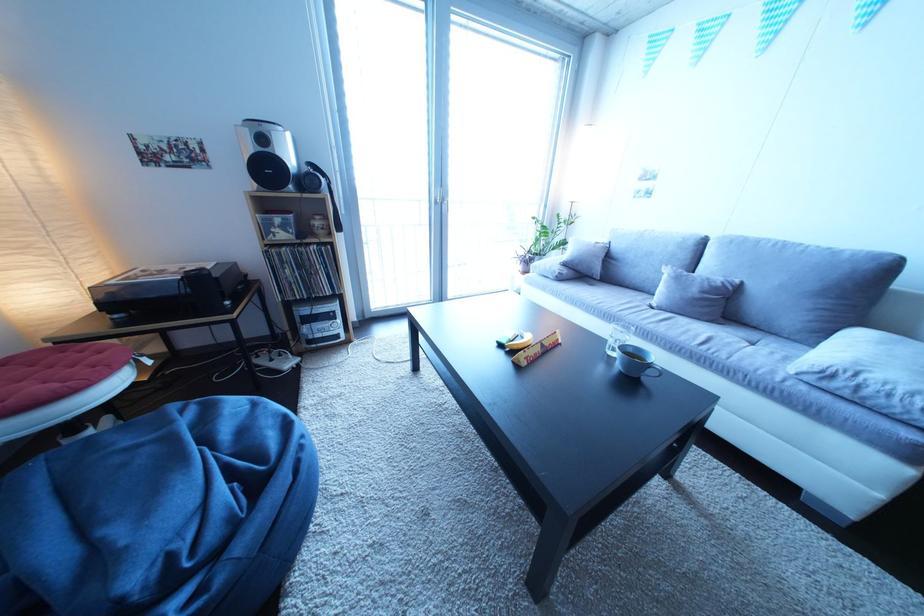
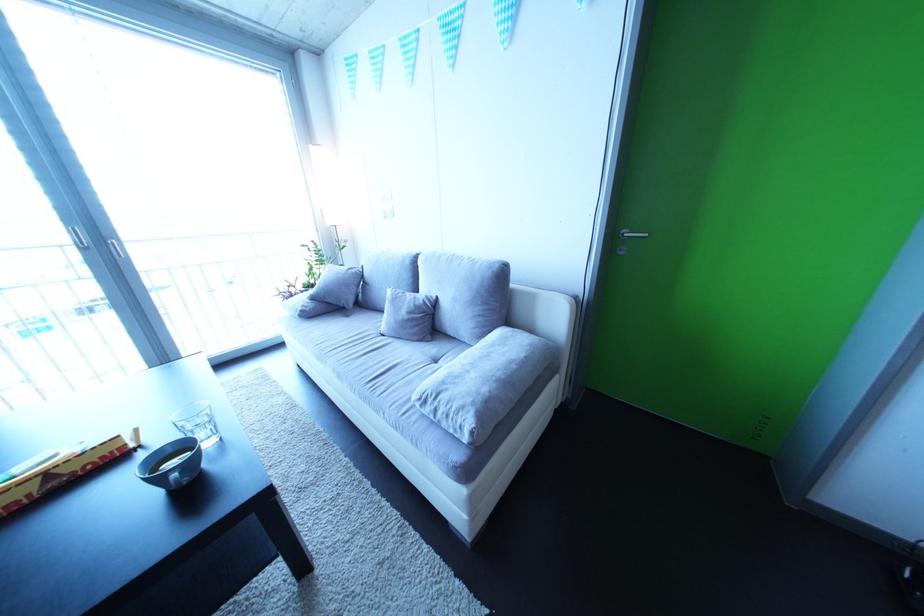
Question: In a continuous first-person perspective shot, in which direction is the camera moving?

Choices:
 (A) Left
 (B) Right
 (C) Forward
 (D) Backward

Answer: (B)